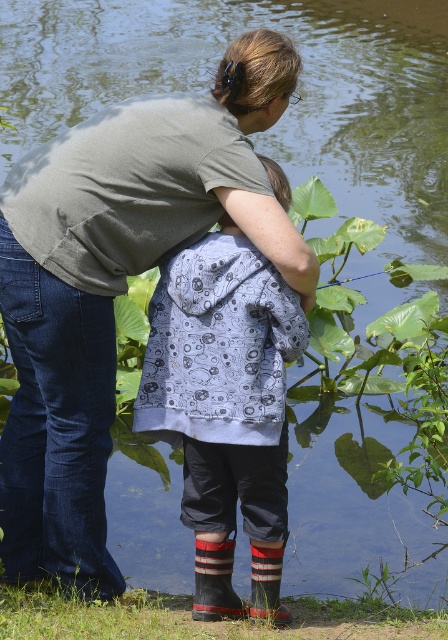
You are a fashion designer observing the scene. You need to determine which item of clothing is bigger between the patterned fabric hoodie at center and the striped wool socks at lower center. Which one is larger?

The patterned fabric hoodie at center is larger than the striped wool socks at lower center.

You are a fashion designer observing the child in the scene. The child is wearing a patterned fabric hoodie at center and striped wool socks at lower center. Which clothing item is positioned higher on the child?

The patterned fabric hoodie at center is located above the striped wool socks at lower center, so the hoodie is positioned higher on the child.